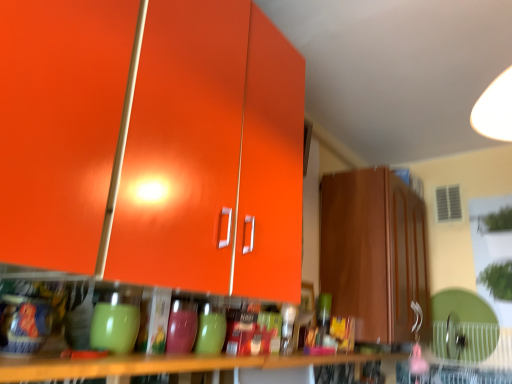
The width and height of the screenshot is (512, 384). Identify the location of matte brown cabinet at right, the 1th cabinetry in the back-to-front sequence. (374, 253).

Locate an element on the screen. The image size is (512, 384). wooden table at lower center is located at coordinates (163, 365).

Locate an element on the screen. The height and width of the screenshot is (384, 512). glossy orange cabinet at upper left, which is the 1th cabinetry from left to right is located at coordinates pos(212,155).

Considering the relative sizes of matte brown cabinet at right, the 1th cabinetry in the back-to-front sequence, and glossy orange cabinet at upper left, which is the 1th cabinetry from left to right, in the image provided, is matte brown cabinet at right, the 1th cabinetry in the back-to-front sequence, taller than glossy orange cabinet at upper left, which is the 1th cabinetry from left to right,?

In fact, matte brown cabinet at right, the 1th cabinetry in the back-to-front sequence, may be shorter than glossy orange cabinet at upper left, which is the 1th cabinetry from left to right.

From a real-world perspective, is matte brown cabinet at right, the 1th cabinetry in the back-to-front sequence, beneath glossy orange cabinet at upper left, the 2th cabinetry viewed from the right?

Correct, in the physical world, matte brown cabinet at right, the 1th cabinetry in the back-to-front sequence, is lower than glossy orange cabinet at upper left, the 2th cabinetry viewed from the right.

Can you see matte brown cabinet at right, the second cabinetry when ordered from left to right, touching glossy orange cabinet at upper left, which is the 1th cabinetry from left to right?

No, matte brown cabinet at right, the second cabinetry when ordered from left to right, is not in contact with glossy orange cabinet at upper left, which is the 1th cabinetry from left to right.

From the image's perspective, does matte brown cabinet at right, the 2th cabinetry viewed from the front, appear lower than glossy orange cabinet at upper left, placed as the 2th cabinetry when sorted from back to front?

Yes, from the image's perspective, matte brown cabinet at right, the 2th cabinetry viewed from the front, is beneath glossy orange cabinet at upper left, placed as the 2th cabinetry when sorted from back to front.

From a real-world perspective, who is located higher, glossy orange cabinet at upper left, placed as the 2th cabinetry when sorted from back to front, or matte brown cabinet at right, the 2th cabinetry viewed from the front?

In real-world perspective, glossy orange cabinet at upper left, placed as the 2th cabinetry when sorted from back to front, is above.

From the image's perspective, which object appears higher, glossy orange cabinet at upper left, which is the 1th cabinetry from left to right, or matte brown cabinet at right, the 1th cabinetry in the back-to-front sequence?

glossy orange cabinet at upper left, which is the 1th cabinetry from left to right, is shown above in the image.

In the scene shown: How many degrees apart are the facing directions of glossy orange cabinet at upper left, the 2th cabinetry viewed from the right, and matte brown cabinet at right, the 1th cabinetry in the back-to-front sequence?

glossy orange cabinet at upper left, the 2th cabinetry viewed from the right, and matte brown cabinet at right, the 1th cabinetry in the back-to-front sequence, are facing 0.715 degrees away from each other.

Is point (148, 120) closer to viewer compared to point (327, 213)?

Yes, point (148, 120) is in front of point (327, 213).

From the picture: From the image's perspective, is glossy orange cabinet at upper left, arranged as the 1th cabinetry when viewed from the front, above or below wooden table at lower center?

Based on their image positions, glossy orange cabinet at upper left, arranged as the 1th cabinetry when viewed from the front, is located above wooden table at lower center.

Measure the distance between glossy orange cabinet at upper left, which is the 1th cabinetry from left to right, and wooden table at lower center.

glossy orange cabinet at upper left, which is the 1th cabinetry from left to right, is 45.52 centimeters from wooden table at lower center.

Which object is wider, glossy orange cabinet at upper left, arranged as the 1th cabinetry when viewed from the front, or wooden table at lower center?

With larger width is glossy orange cabinet at upper left, arranged as the 1th cabinetry when viewed from the front.

Which is correct: glossy orange cabinet at upper left, arranged as the 1th cabinetry when viewed from the front, is inside wooden table at lower center, or outside of it?

glossy orange cabinet at upper left, arranged as the 1th cabinetry when viewed from the front, is not enclosed by wooden table at lower center.

From a real-world perspective, is wooden table at lower center located beneath matte brown cabinet at right, the 2th cabinetry viewed from the front?

Yes, from a real-world perspective, wooden table at lower center is below matte brown cabinet at right, the 2th cabinetry viewed from the front.

Is matte brown cabinet at right, the 2th cabinetry viewed from the front, at the back of wooden table at lower center?

No, wooden table at lower center is not facing the opposite direction of matte brown cabinet at right, the 2th cabinetry viewed from the front.

The width and height of the screenshot is (512, 384). I want to click on table lying in front of the matte brown cabinet at right, the second cabinetry when ordered from left to right, so click(163, 365).

Would you say wooden table at lower center is inside or outside matte brown cabinet at right, the first cabinetry viewed from the right?

wooden table at lower center cannot be found inside matte brown cabinet at right, the first cabinetry viewed from the right.

How different are the orientations of wooden table at lower center and glossy orange cabinet at upper left, arranged as the 1th cabinetry when viewed from the front, in degrees?

They differ by 0.715 degrees in their facing directions.

Looking at their sizes, would you say wooden table at lower center is wider or thinner than glossy orange cabinet at upper left, which is the 1th cabinetry from left to right?

wooden table at lower center is thinner than glossy orange cabinet at upper left, which is the 1th cabinetry from left to right.

Between point (142, 363) and point (274, 190), which one is positioned in front?

The point (142, 363) is more forward.

In terms of height, does wooden table at lower center look taller or shorter compared to glossy orange cabinet at upper left, placed as the 2th cabinetry when sorted from back to front?

Clearly, wooden table at lower center is shorter compared to glossy orange cabinet at upper left, placed as the 2th cabinetry when sorted from back to front.

Considering the relative sizes of matte brown cabinet at right, the 2th cabinetry viewed from the front, and wooden table at lower center in the image provided, is matte brown cabinet at right, the 2th cabinetry viewed from the front, shorter than wooden table at lower center?

In fact, matte brown cabinet at right, the 2th cabinetry viewed from the front, may be taller than wooden table at lower center.

Based on the photo, is matte brown cabinet at right, the 1th cabinetry in the back-to-front sequence, far away from wooden table at lower center?

No.

Between matte brown cabinet at right, the 2th cabinetry viewed from the front, and wooden table at lower center, which one has larger width?

Wider between the two is matte brown cabinet at right, the 2th cabinetry viewed from the front.

Locate an element on the screen. cabinetry to the left of matte brown cabinet at right, the 1th cabinetry in the back-to-front sequence is located at coordinates (212, 155).

This screenshot has width=512, height=384. Find the location of `cabinetry located underneath the glossy orange cabinet at upper left, the 2th cabinetry viewed from the right (from a real-world perspective)`. cabinetry located underneath the glossy orange cabinet at upper left, the 2th cabinetry viewed from the right (from a real-world perspective) is located at coordinates (374, 253).

From the image, which object appears to be farther from matte brown cabinet at right, the second cabinetry when ordered from left to right, glossy orange cabinet at upper left, placed as the 2th cabinetry when sorted from back to front, or wooden table at lower center?

glossy orange cabinet at upper left, placed as the 2th cabinetry when sorted from back to front.

Looking at the image, which one is located closer to glossy orange cabinet at upper left, which is the 1th cabinetry from left to right, wooden table at lower center or matte brown cabinet at right, the 2th cabinetry viewed from the front?

Based on the image, wooden table at lower center appears to be nearer to glossy orange cabinet at upper left, which is the 1th cabinetry from left to right.

In the scene shown: When comparing their distances from matte brown cabinet at right, the 2th cabinetry viewed from the front, does wooden table at lower center or glossy orange cabinet at upper left, placed as the 2th cabinetry when sorted from back to front, seem closer?

The object closer to matte brown cabinet at right, the 2th cabinetry viewed from the front, is wooden table at lower center.

Estimate the real-world distances between objects in this image. Which object is further from glossy orange cabinet at upper left, arranged as the 1th cabinetry when viewed from the front, matte brown cabinet at right, the first cabinetry viewed from the right, or wooden table at lower center?

Among the two, matte brown cabinet at right, the first cabinetry viewed from the right, is located further to glossy orange cabinet at upper left, arranged as the 1th cabinetry when viewed from the front.

Based on their spatial positions, is glossy orange cabinet at upper left, arranged as the 1th cabinetry when viewed from the front, or matte brown cabinet at right, the 2th cabinetry viewed from the front, further from wooden table at lower center?

Based on the image, matte brown cabinet at right, the 2th cabinetry viewed from the front, appears to be further to wooden table at lower center.

Based on their spatial positions, is matte brown cabinet at right, the 1th cabinetry in the back-to-front sequence, or glossy orange cabinet at upper left, placed as the 2th cabinetry when sorted from back to front, closer to wooden table at lower center?

glossy orange cabinet at upper left, placed as the 2th cabinetry when sorted from back to front.

The image size is (512, 384). I want to click on table positioned between glossy orange cabinet at upper left, the 2th cabinetry viewed from the right, and matte brown cabinet at right, the second cabinetry when ordered from left to right, from near to far, so click(163, 365).